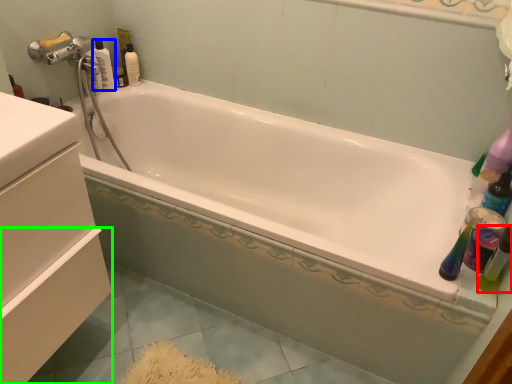
Question: Considering the real-world distances, which object is farthest from mouthwash (highlighted by a red box)? bottle (highlighted by a blue box) or drawer (highlighted by a green box)?

Choices:
 (A) bottle
 (B) drawer

Answer: (A)